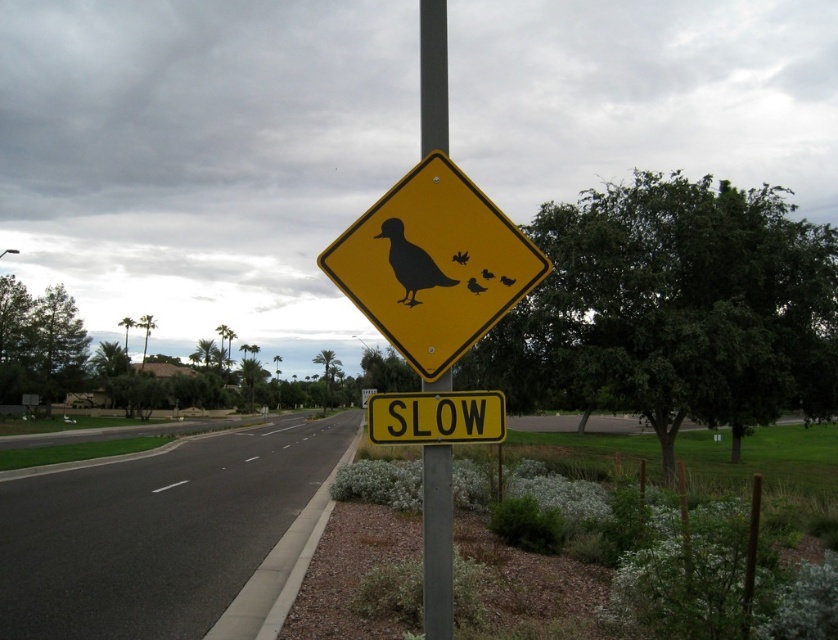
Question: Does metallic pole at center have a greater width compared to black matte duck at center?

Choices:
 (A) yes
 (B) no

Answer: (B)

Question: Can you confirm if metallic pole at center is wider than yellow matte/solid sign at center?

Choices:
 (A) yes
 (B) no

Answer: (B)

Question: Is black matte duck at center closer to the viewer compared to black matte bird at upper center?

Choices:
 (A) yes
 (B) no

Answer: (A)

Question: Among these points, which one is nearest to the camera?

Choices:
 (A) (419, 168)
 (B) (458, 252)
 (C) (397, 232)
 (D) (503, 280)

Answer: (D)

Question: Which point is closer to the camera taking this photo?

Choices:
 (A) (412, 250)
 (B) (433, 548)

Answer: (B)

Question: Which of the following is the farthest from the observer?

Choices:
 (A) yellow diamond-shaped sign with black duck and chicks at center
 (B) matte black duck at center
 (C) black matte duck at upper center
 (D) yellow matte/solid sign at center

Answer: (C)